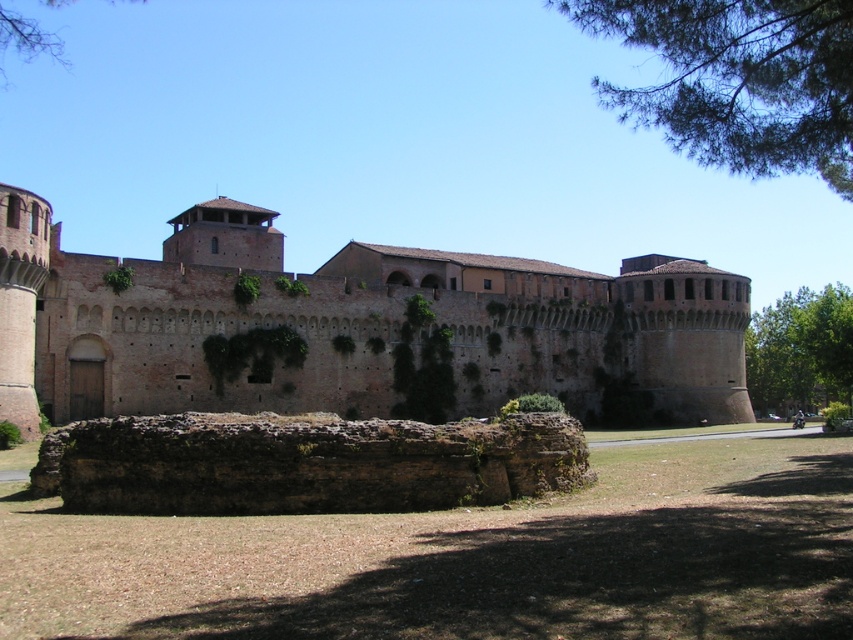
Question: Does brown brick wall at center come in front of green leafy tree at upper left?

Choices:
 (A) yes
 (B) no

Answer: (A)

Question: Does green leafy tree at upper right have a smaller size compared to green leafy tree at upper left?

Choices:
 (A) no
 (B) yes

Answer: (B)

Question: Observing the image, what is the correct spatial positioning of green leafy tree at right in reference to green leafy tree at upper left?

Choices:
 (A) below
 (B) above

Answer: (A)

Question: Which object appears closest to the camera in this image?

Choices:
 (A) green leafy tree at upper right
 (B) green leafy tree at upper left

Answer: (A)

Question: Considering the real-world distances, which object is closest to the brown brick wall at center?

Choices:
 (A) green leafy tree at right
 (B) green leafy tree at upper left

Answer: (A)

Question: Which point appears closest to the camera in this image?

Choices:
 (A) (850, 330)
 (B) (837, 22)
 (C) (0, 10)
 (D) (561, 326)

Answer: (B)